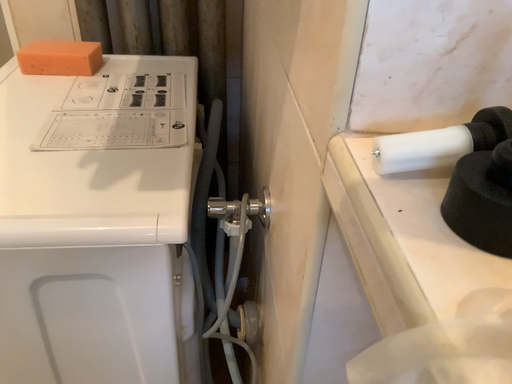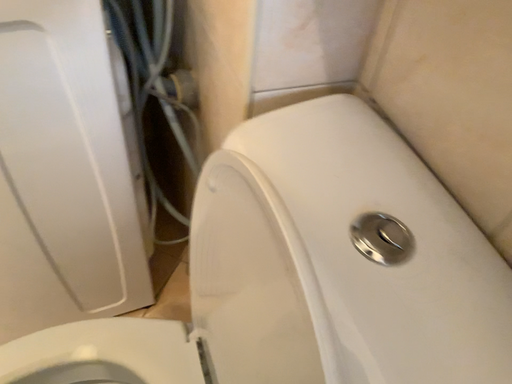
Question: How did the camera likely rotate when shooting the video?

Choices:
 (A) rotated downward
 (B) rotated upward

Answer: (A)